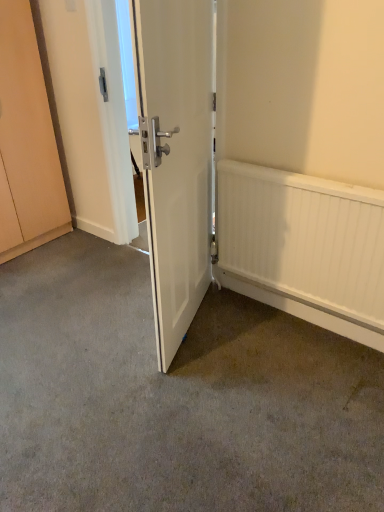
Question: Can you confirm if white textured radiator at right is shorter than gray carpet at center?

Choices:
 (A) no
 (B) yes

Answer: (A)

Question: Is white textured radiator at right closer to camera compared to gray carpet at center?

Choices:
 (A) no
 (B) yes

Answer: (A)

Question: From the image's perspective, is white textured radiator at right beneath gray carpet at center?

Choices:
 (A) yes
 (B) no

Answer: (B)

Question: From a real-world perspective, is white textured radiator at right located beneath gray carpet at center?

Choices:
 (A) no
 (B) yes

Answer: (A)

Question: Is white textured radiator at right facing towards gray carpet at center?

Choices:
 (A) yes
 (B) no

Answer: (A)

Question: Is white textured radiator at right beside gray carpet at center?

Choices:
 (A) yes
 (B) no

Answer: (B)

Question: Can you confirm if gray carpet at center is shorter than matte wood cabinet at left?

Choices:
 (A) yes
 (B) no

Answer: (A)

Question: Considering the relative sizes of gray carpet at center and matte wood cabinet at left in the image provided, is gray carpet at center taller than matte wood cabinet at left?

Choices:
 (A) no
 (B) yes

Answer: (A)

Question: Is gray carpet at center smaller than matte wood cabinet at left?

Choices:
 (A) no
 (B) yes

Answer: (B)

Question: Is gray carpet at center positioned far away from matte wood cabinet at left?

Choices:
 (A) yes
 (B) no

Answer: (A)

Question: Can you confirm if gray carpet at center is thinner than matte wood cabinet at left?

Choices:
 (A) no
 (B) yes

Answer: (A)

Question: Is gray carpet at center touching matte wood cabinet at left?

Choices:
 (A) no
 (B) yes

Answer: (A)

Question: From a real-world perspective, is white matte door at center under matte wood cabinet at left?

Choices:
 (A) no
 (B) yes

Answer: (B)